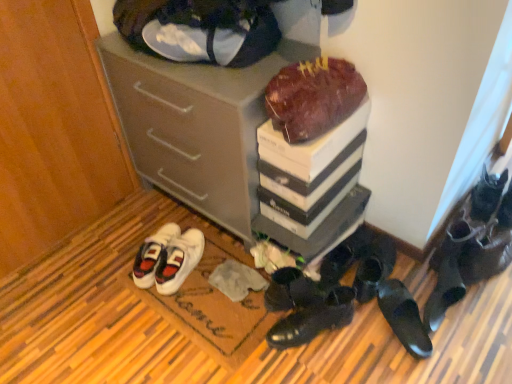
At what (x,y) coordinates should I click in order to perform the action: click on vacant space to the left of black leather shoes at lower center, acting as the second footwear starting from the left. Please return your answer as a coordinate pair (x, y). The image size is (512, 384). Looking at the image, I should click on (241, 342).